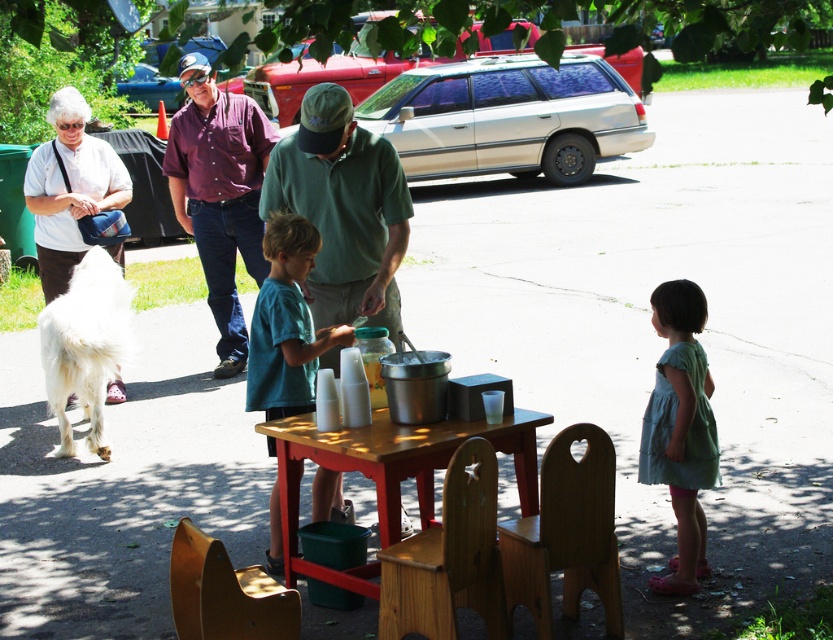
Is teal t-shirt at center taller than white fabric purse at left?

Correct, teal t-shirt at center is much taller as white fabric purse at left.

Image resolution: width=833 pixels, height=640 pixels. What are the coordinates of `teal t-shirt at center` in the screenshot? It's located at (287, 324).

Can you confirm if white fabric purse at left is positioned to the right of white fluffy dog at lower left?

Incorrect, white fabric purse at left is not on the right side of white fluffy dog at lower left.

Who is taller, white fabric purse at left or white fluffy dog at lower left?

With more height is white fabric purse at left.

The width and height of the screenshot is (833, 640). I want to click on white fabric purse at left, so click(x=68, y=188).

Locate an element on the screen. Image resolution: width=833 pixels, height=640 pixels. white fabric purse at left is located at coordinates (68, 188).

Can you confirm if wooden table at center is positioned to the right of green cotton dress at lower right?

No, wooden table at center is not to the right of green cotton dress at lower right.

Is wooden table at center bigger than green cotton dress at lower right?

Correct, wooden table at center is larger in size than green cotton dress at lower right.

Where is `wooden table at center`? Image resolution: width=833 pixels, height=640 pixels. wooden table at center is located at coordinates (388, 474).